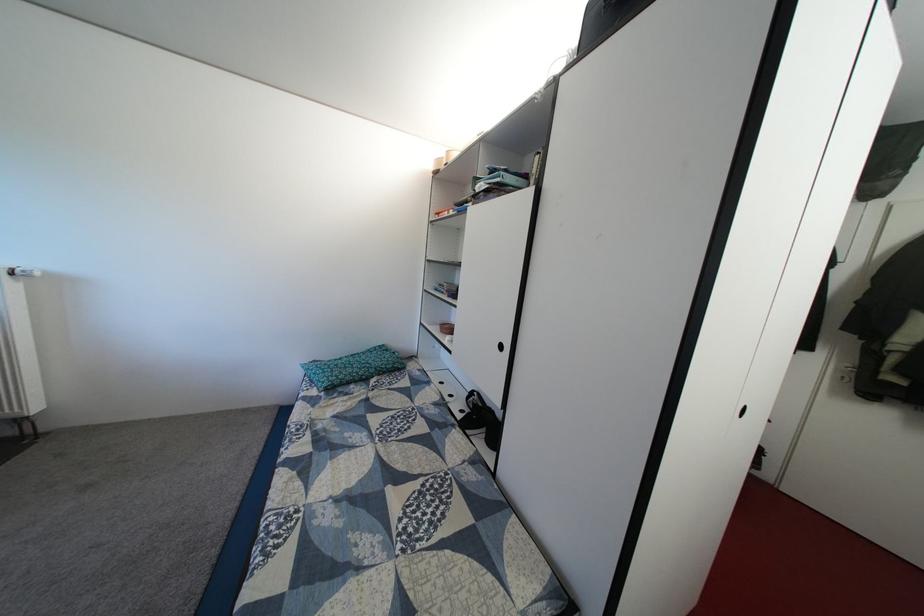
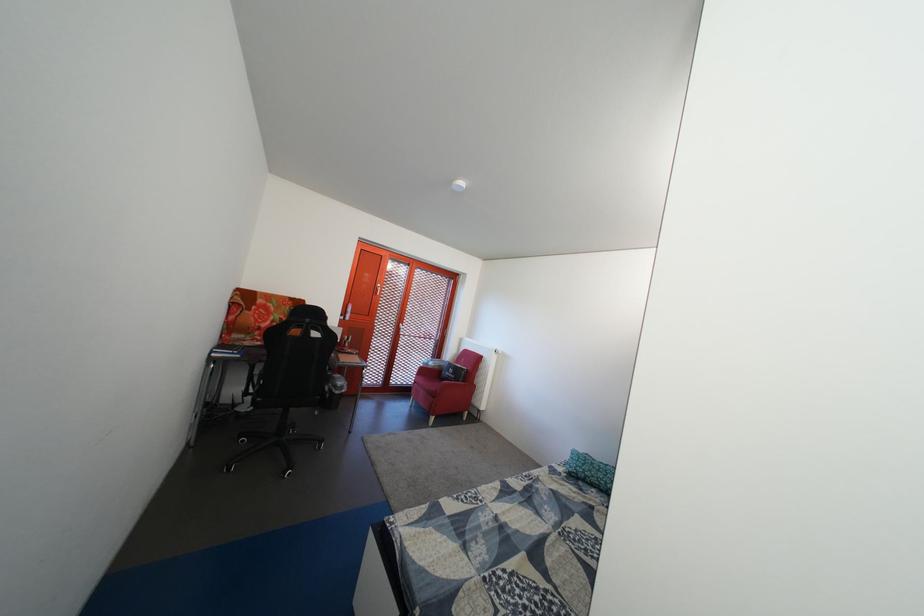
Question: How did the camera likely rotate?

Choices:
 (A) Left
 (B) Right
 (C) Up
 (D) Down

Answer: (A)